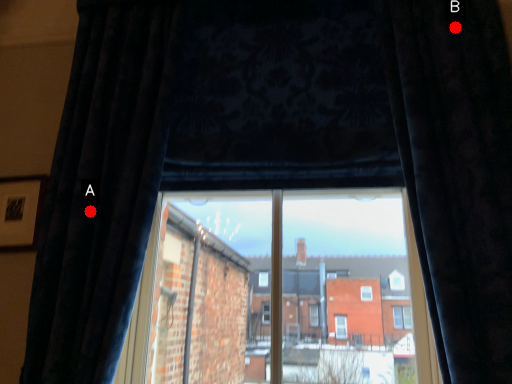
Question: Two points are circled on the image, labeled by A and B beside each circle. Among these points, which one is farthest from the camera?

Choices:
 (A) A is further
 (B) B is further

Answer: (B)